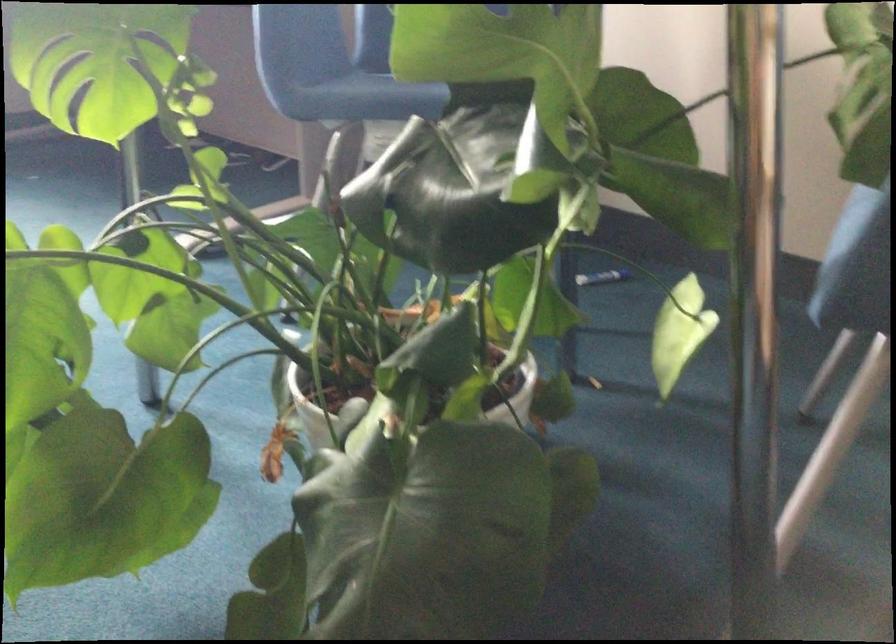
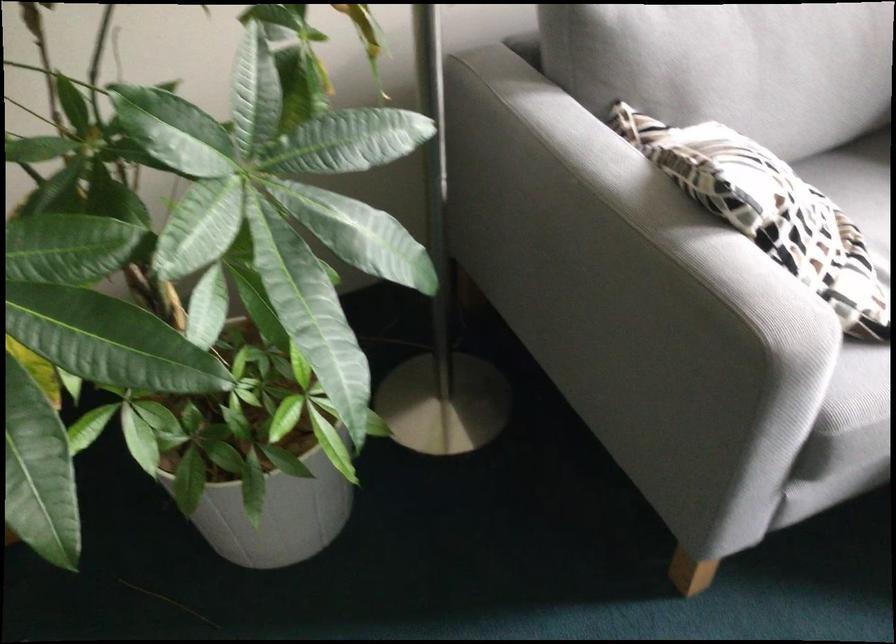
The images are taken continuously from a first-person perspective. In which direction is your viewpoint rotating?

The rotation direction of the camera is left-down.